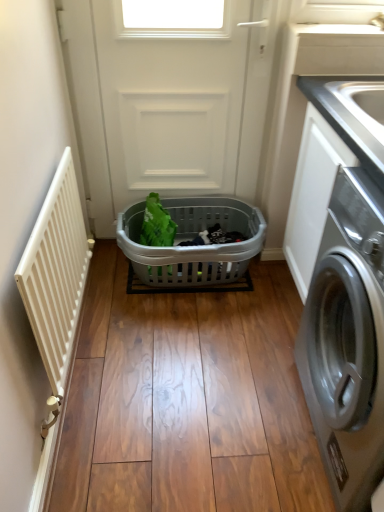
Question: Does silver metallic washing machine at right have a smaller size compared to white glossy countertop at upper right?

Choices:
 (A) yes
 (B) no

Answer: (B)

Question: Is silver metallic washing machine at right at the left side of white glossy countertop at upper right?

Choices:
 (A) no
 (B) yes

Answer: (B)

Question: Is silver metallic washing machine at right further to the viewer compared to white glossy countertop at upper right?

Choices:
 (A) yes
 (B) no

Answer: (B)

Question: From the image's perspective, is silver metallic washing machine at right on white glossy countertop at upper right?

Choices:
 (A) no
 (B) yes

Answer: (A)

Question: From a real-world perspective, is silver metallic washing machine at right on top of white glossy countertop at upper right?

Choices:
 (A) yes
 (B) no

Answer: (B)

Question: Considering the relative sizes of silver metallic washing machine at right and white glossy countertop at upper right in the image provided, is silver metallic washing machine at right shorter than white glossy countertop at upper right?

Choices:
 (A) yes
 (B) no

Answer: (B)

Question: Can you confirm if white matte radiator at left is bigger than silver metallic washing machine at right?

Choices:
 (A) yes
 (B) no

Answer: (B)

Question: Is white matte radiator at left taller than silver metallic washing machine at right?

Choices:
 (A) no
 (B) yes

Answer: (A)

Question: From a real-world perspective, is white matte radiator at left physically below silver metallic washing machine at right?

Choices:
 (A) no
 (B) yes

Answer: (B)

Question: Can you confirm if white matte radiator at left is thinner than silver metallic washing machine at right?

Choices:
 (A) yes
 (B) no

Answer: (A)

Question: Could you tell me if white matte radiator at left is facing silver metallic washing machine at right?

Choices:
 (A) no
 (B) yes

Answer: (B)

Question: Considering the relative sizes of white matte radiator at left and silver metallic washing machine at right in the image provided, is white matte radiator at left smaller than silver metallic washing machine at right?

Choices:
 (A) no
 (B) yes

Answer: (B)

Question: Can white matte screen door at center be found inside gray plastic basket at center?

Choices:
 (A) yes
 (B) no

Answer: (B)